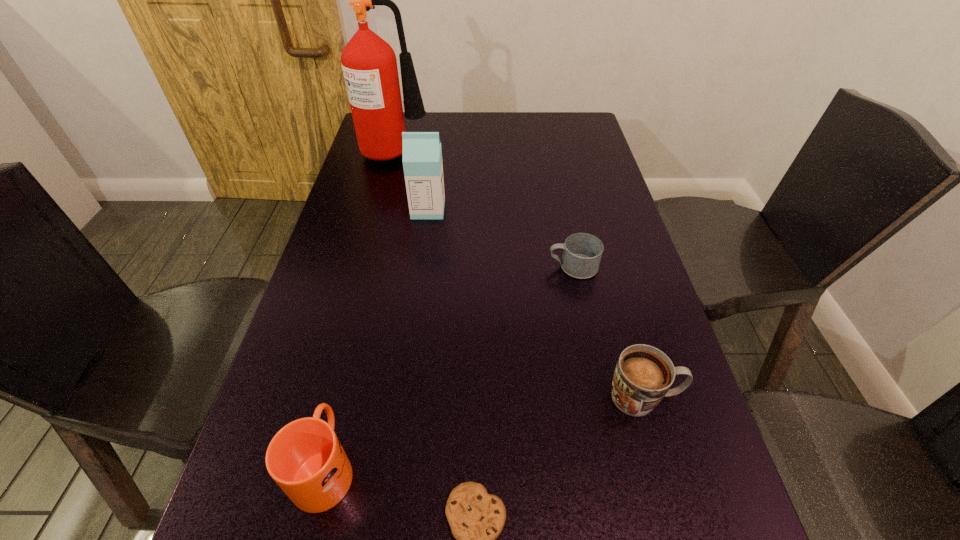
Locate an element on the screen. The width and height of the screenshot is (960, 540). free space between the milk carton and the tallest mug is located at coordinates (376, 338).

The width and height of the screenshot is (960, 540). Identify the location of empty space between the tallest mug and the fifth tallest object. (449, 367).

Where is `free space between the milk carton and the nearest mug`? This screenshot has height=540, width=960. free space between the milk carton and the nearest mug is located at coordinates (376, 338).

Where is `empty space between the second shortest object and the second nearest mug`? This screenshot has height=540, width=960. empty space between the second shortest object and the second nearest mug is located at coordinates (609, 332).

At what (x,y) coordinates should I click in order to perform the action: click on object that stands as the third closest to the second shortest mug. Please return your answer as a coordinate pair (x, y). This screenshot has width=960, height=540. Looking at the image, I should click on (305, 458).

Locate an element on the screen. This screenshot has width=960, height=540. object that is the fifth closest to the tallest object is located at coordinates (476, 518).

Identify which mug is the third closest to the cookie. Please provide its 2D coordinates. Your answer should be formatted as a tuple, i.e. [(x, y)], where the tuple contains the x and y coordinates of a point satisfying the conditions above.

[(582, 252)]

The image size is (960, 540). I want to click on mug that is the closest to the shortest object, so click(305, 458).

Where is `free spot that satisfies the following two spatial constraints: 1. on the handle side of the fourth shortest object; 2. at the nozzle of the farthest object`? free spot that satisfies the following two spatial constraints: 1. on the handle side of the fourth shortest object; 2. at the nozzle of the farthest object is located at coordinates (401, 150).

Identify the location of free space that satisfies the following two spatial constraints: 1. on the handle side of the leftmost mug; 2. on the right side of the fifth nearest object. The height and width of the screenshot is (540, 960). (387, 210).